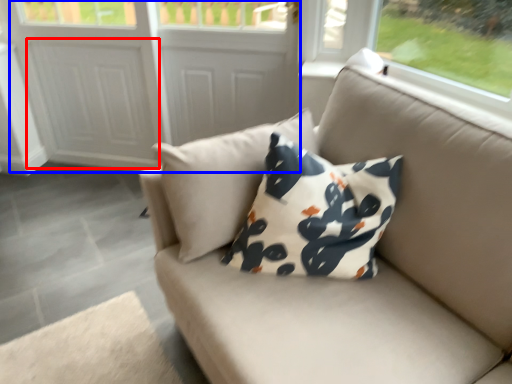
Question: Which object appears farthest to the camera in this image, screen door (highlighted by a red box) or screen door (highlighted by a blue box)?

Choices:
 (A) screen door
 (B) screen door

Answer: (A)